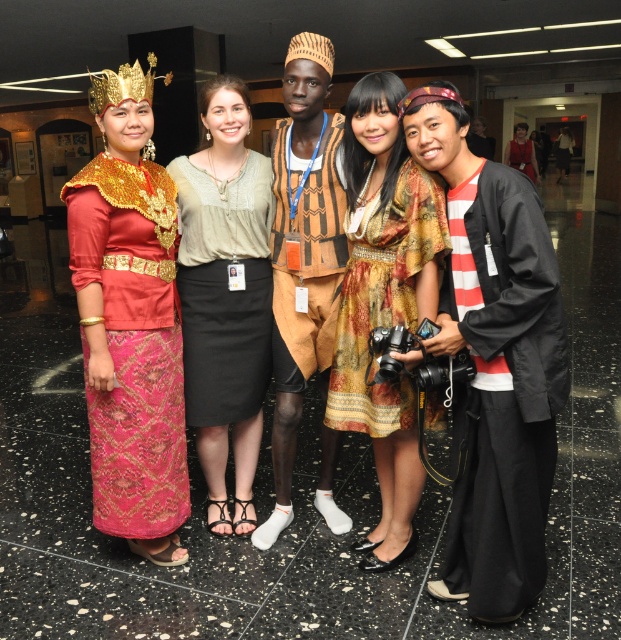
Question: Can you confirm if light beige textured blouse at center is positioned above printed fabric dress at center?

Choices:
 (A) no
 (B) yes

Answer: (B)

Question: Which of the following is the farthest from the observer?

Choices:
 (A) (193, 156)
 (B) (476, 602)
 (C) (383, 397)

Answer: (A)

Question: Which point is closer to the camera?

Choices:
 (A) (383, 248)
 (B) (142, 198)
 (C) (242, 378)
 (D) (542, 280)

Answer: (D)

Question: Which of the following is the closest to the observer?

Choices:
 (A) light beige textured blouse at center
 (B) matte gold crown at upper left
 (C) black matte robe at right

Answer: (C)

Question: Is light beige textured blouse at center to the right of printed fabric dress at center from the viewer's perspective?

Choices:
 (A) yes
 (B) no

Answer: (B)

Question: Does matte gold crown at upper left appear on the right side of light beige textured blouse at center?

Choices:
 (A) yes
 (B) no

Answer: (B)